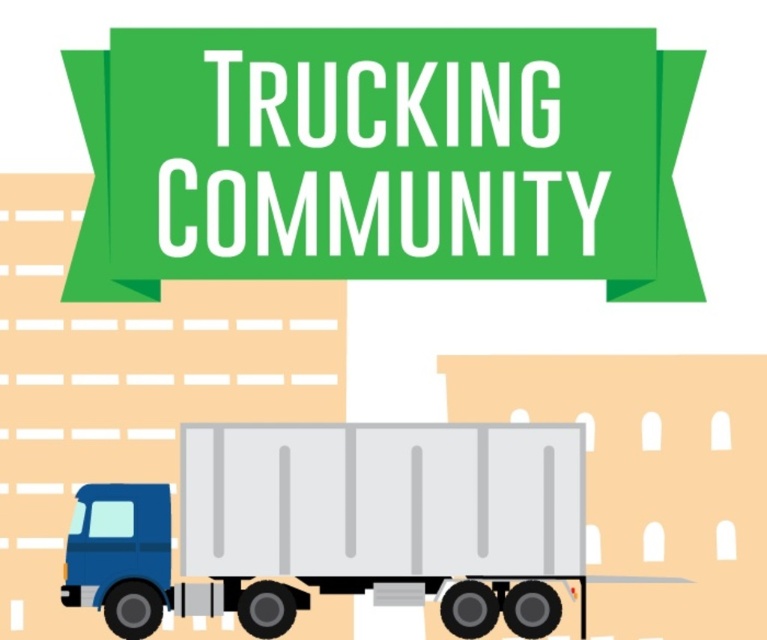
I want to click on green fabric banner at upper center, so click(x=382, y=157).

Does green fabric banner at upper center have a greater height compared to matte gray trailer truck at lower left?

No.

Measure the distance between green fabric banner at upper center and camera.

green fabric banner at upper center and camera are 11.98 meters apart from each other.

Find the location of `green fabric banner at upper center`. green fabric banner at upper center is located at coordinates (382, 157).